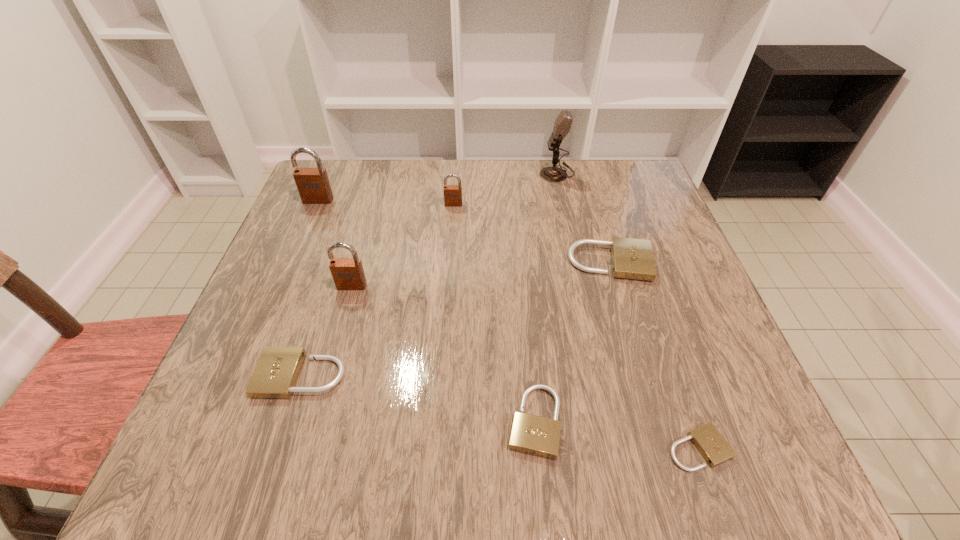
Locate an element on the screen. Image resolution: width=960 pixels, height=540 pixels. the third shortest object is located at coordinates (275, 375).

The width and height of the screenshot is (960, 540). I want to click on the third shortest padlock, so click(275, 375).

Where is `the second shortest padlock`? The image size is (960, 540). the second shortest padlock is located at coordinates (532, 434).

The width and height of the screenshot is (960, 540). I want to click on the fourth object from right to left, so click(x=532, y=434).

The height and width of the screenshot is (540, 960). I want to click on the shortest padlock, so click(x=708, y=440).

The height and width of the screenshot is (540, 960). I want to click on the shortest object, so 708,440.

What are the coordinates of `free space located on the front-facing side of the farthest object` in the screenshot? It's located at (521, 173).

The image size is (960, 540). I want to click on vacant space located on the front-facing side of the farthest object, so click(445, 173).

Find the location of `free region located 0.120m on the front-facing side of the farthest object`. free region located 0.120m on the front-facing side of the farthest object is located at coordinates (496, 173).

Find the location of a particular element. The image size is (960, 540). free space located 0.370m on the front-facing side of the seventh shortest object is located at coordinates (268, 318).